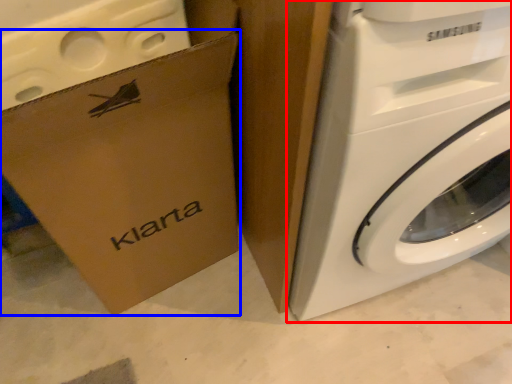
Question: Which object appears farthest to the camera in this image, washing machine (highlighted by a red box) or cardboard box (highlighted by a blue box)?

Choices:
 (A) washing machine
 (B) cardboard box

Answer: (B)